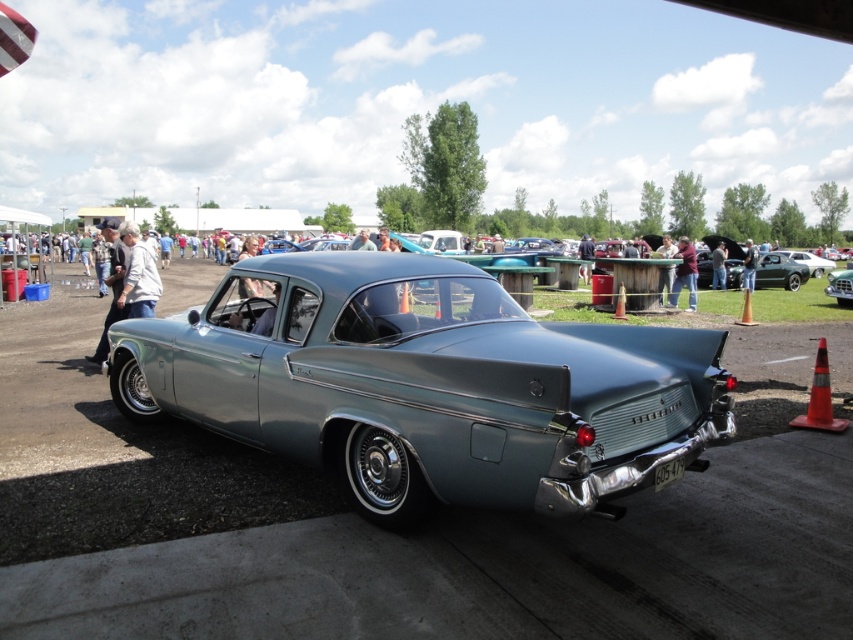
Does orange reflective cone at lower right lie in front of light gray fabric jacket at left?

Yes, orange reflective cone at lower right is in front of light gray fabric jacket at left.

Is orange reflective cone at lower right to the right of light gray fabric jacket at left from the viewer's perspective?

Correct, you'll find orange reflective cone at lower right to the right of light gray fabric jacket at left.

Image resolution: width=853 pixels, height=640 pixels. What do you see at coordinates (820, 397) in the screenshot?
I see `orange reflective cone at lower right` at bounding box center [820, 397].

Where is `orange reflective cone at lower right`? The height and width of the screenshot is (640, 853). orange reflective cone at lower right is located at coordinates (820, 397).

Which is more to the right, light gray fabric jacket at left or blue fabric shirt at upper right?

Positioned to the right is blue fabric shirt at upper right.

Which of these two, light gray fabric jacket at left or blue fabric shirt at upper right, stands taller?

Standing taller between the two is light gray fabric jacket at left.

Who is more distant from viewer, [115,257] or [718,243]?

Positioned behind is point [718,243].

Find the location of a particular element. This screenshot has width=853, height=640. light gray fabric jacket at left is located at coordinates (111, 284).

Is shiny chrome grille at center below orange traffic cone at right?

Incorrect, shiny chrome grille at center is not positioned below orange traffic cone at right.

Is shiny chrome grille at center thinner than orange traffic cone at right?

In fact, shiny chrome grille at center might be wider than orange traffic cone at right.

Between point (846, 273) and point (750, 314), which one is positioned behind?

The point (846, 273) is more distant.

Where is `shiny chrome grille at center`? This screenshot has width=853, height=640. shiny chrome grille at center is located at coordinates (840, 285).